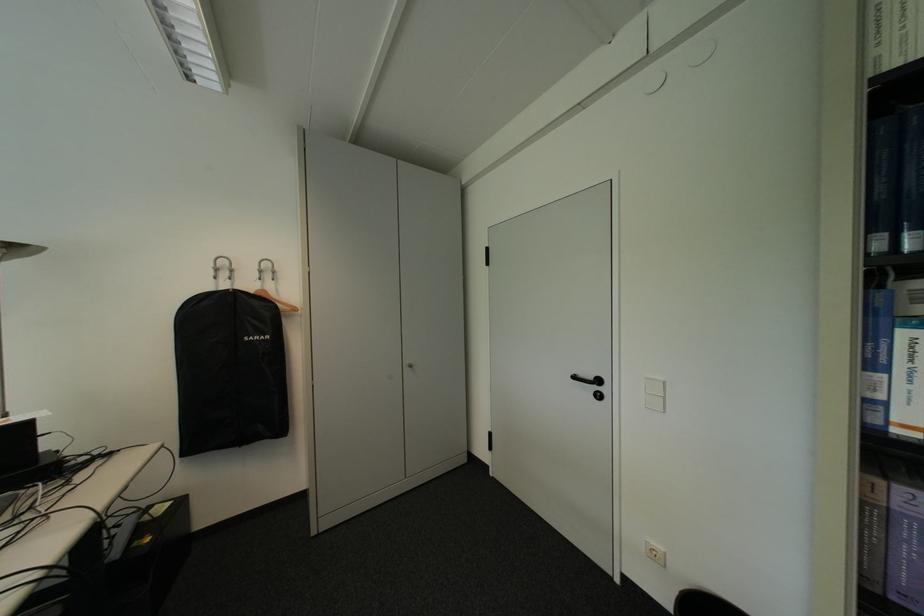
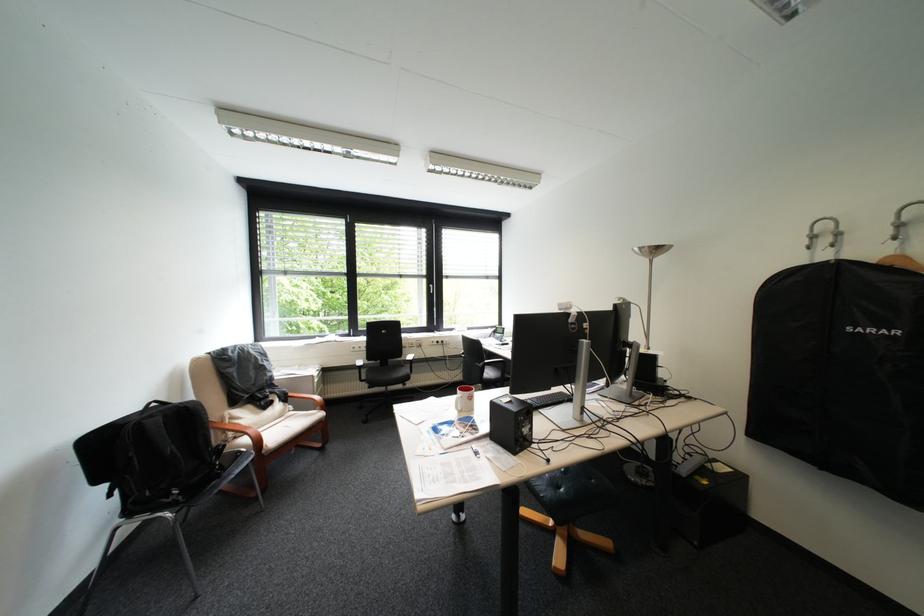
Question: I am providing you with two images of the same scene from different viewpoints. After the viewpoint changes to image2, which objects are now occluded?

Choices:
 (A) chair sitting surface
 (B) red and white mug
 (C) black backpack
 (D) none of these

Answer: (D)